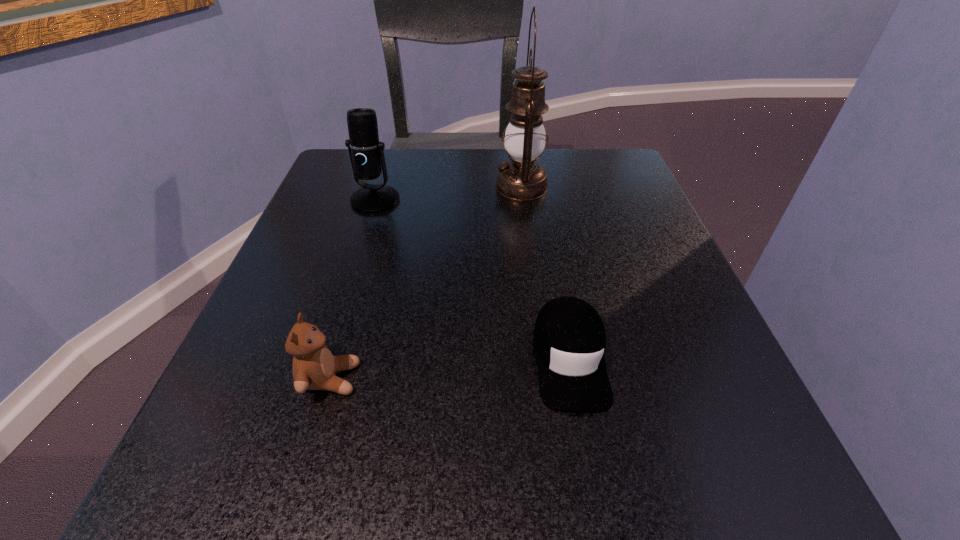
Identify which object is located as the second nearest to the cap. Please provide its 2D coordinates. Your answer should be formatted as a tuple, i.e. [(x, y)], where the tuple contains the x and y coordinates of a point satisfying the conditions above.

[(522, 178)]

Where is `vacant space that satisfies the following two spatial constraints: 1. on the back side of the third shortest object; 2. on the left side of the oil lamp`? vacant space that satisfies the following two spatial constraints: 1. on the back side of the third shortest object; 2. on the left side of the oil lamp is located at coordinates (379, 186).

Identify the location of blank area in the image that satisfies the following two spatial constraints: 1. on the front-facing side of the shortest object; 2. on the front-facing side of the teddy bear. coord(573,379).

Locate an element on the screen. free space that satisfies the following two spatial constraints: 1. on the front-facing side of the cap; 2. on the front-facing side of the teddy bear is located at coordinates (573, 379).